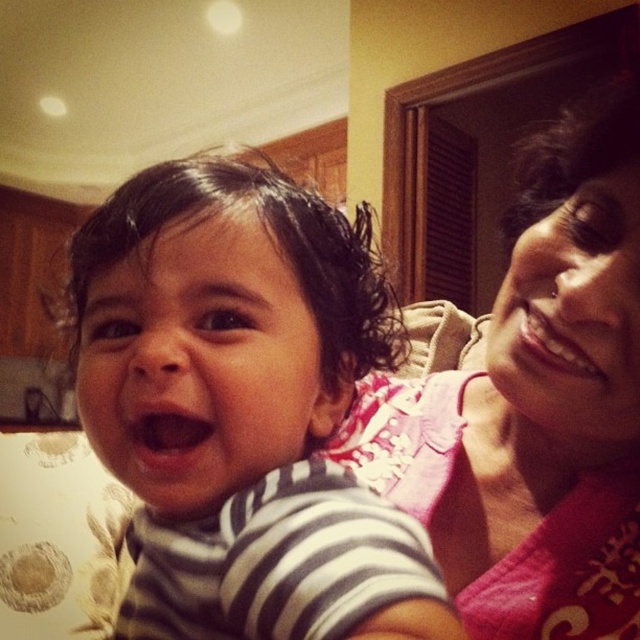
Can you confirm if smooth skin smile at upper right is positioned below pink matte mouth at center?

No.

Which of these two, smooth skin smile at upper right or pink matte mouth at center, stands shorter?

With less height is pink matte mouth at center.

The width and height of the screenshot is (640, 640). What do you see at coordinates (554, 339) in the screenshot?
I see `smooth skin smile at upper right` at bounding box center [554, 339].

What are the coordinates of `smooth skin smile at upper right` in the screenshot? It's located at (554, 339).

Can you confirm if pink fabric at upper right is thinner than striped cotton shirt at center?

Indeed, pink fabric at upper right has a lesser width compared to striped cotton shirt at center.

Which is in front, point (557, 161) or point (275, 243)?

Point (275, 243) is in front.

Identify the location of pink fabric at upper right. Image resolution: width=640 pixels, height=640 pixels. (534, 410).

Between pink fabric at upper right and pink matte mouth at center, which one appears on the left side from the viewer's perspective?

pink matte mouth at center

Which is in front, point (481, 397) or point (193, 428)?

Point (193, 428)

This screenshot has width=640, height=640. I want to click on pink fabric at upper right, so click(534, 410).

You are a GUI agent. You are given a task and a screenshot of the screen. Output one action in this format:
    pyautogui.click(x=<x>, y=<y>)
    Task: Click on the pink fabric at upper right
    The width and height of the screenshot is (640, 640).
    Given the screenshot: What is the action you would take?
    pyautogui.click(x=534, y=410)